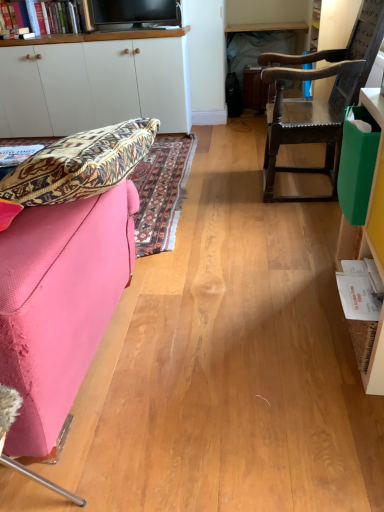
This screenshot has width=384, height=512. I want to click on free space between dark brown wooden chair at right and pink fabric couch at left, so click(x=237, y=254).